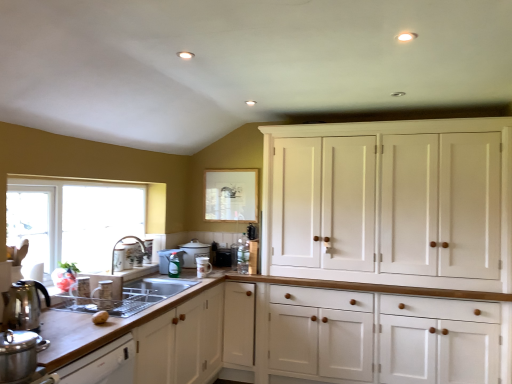
Locate an element on the screen. The width and height of the screenshot is (512, 384). free space that is in between shiny metallic kettle at left and satin silver sink at lower left is located at coordinates (67, 316).